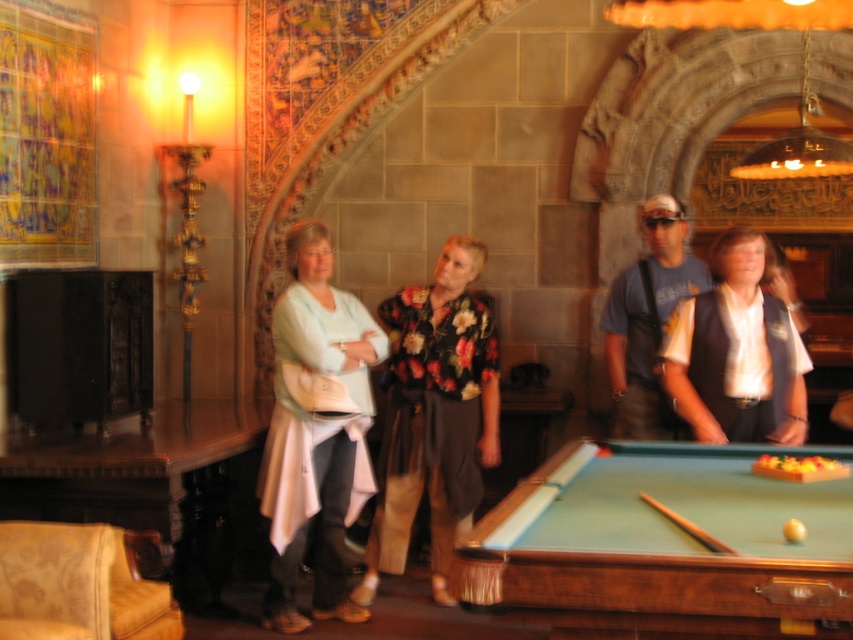
Is light blue fabric coat at center above blue t-shirt at center?

Actually, light blue fabric coat at center is below blue t-shirt at center.

Can you confirm if light blue fabric coat at center is smaller than blue t-shirt at center?

No, light blue fabric coat at center is not smaller than blue t-shirt at center.

Who is more forward, (279,428) or (664,228)?

Positioned in front is point (279,428).

At what (x,y) coordinates should I click in order to perform the action: click on light blue fabric coat at center. Please return your answer as a coordinate pair (x, y). Looking at the image, I should click on (316, 428).

Who is higher up, green felt pool table at center or white shirt with vest at center?

white shirt with vest at center is above.

Is green felt pool table at center thinner than white shirt with vest at center?

Incorrect, green felt pool table at center's width is not less than white shirt with vest at center's.

Is point (621, 589) farther from viewer compared to point (788, 376)?

No, it is in front of (788, 376).

I want to click on green felt pool table at center, so click(x=663, y=547).

Describe the element at coordinates (734, 355) in the screenshot. I see `white shirt with vest at center` at that location.

Between point (798, 412) and point (666, 406), which one is positioned in front?

Positioned in front is point (798, 412).

What are the coordinates of `white shirt with vest at center` in the screenshot? It's located at (734, 355).